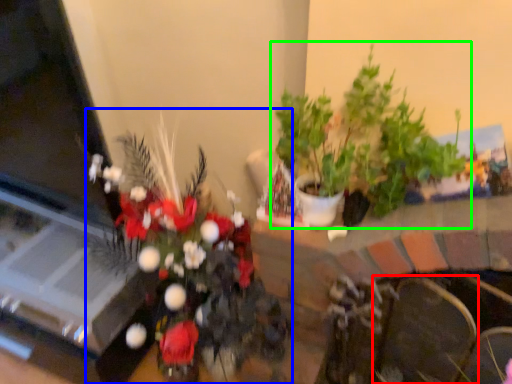
Question: Which object is positioned closest to armchair (highlighted by a red box)? Select from houseplant (highlighted by a blue box) and houseplant (highlighted by a green box).

Choices:
 (A) houseplant
 (B) houseplant

Answer: (B)